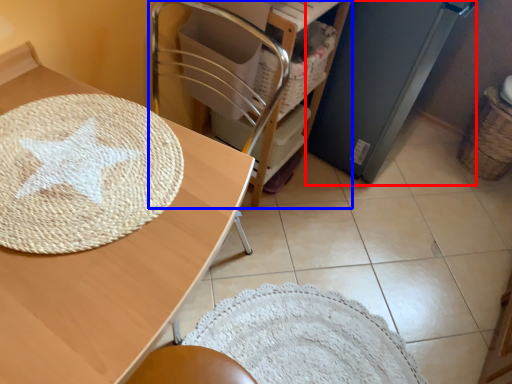
Question: Which of the following is the closest to the observer, appliance (highlighted by a red box) or furniture (highlighted by a blue box)?

Choices:
 (A) appliance
 (B) furniture

Answer: (B)